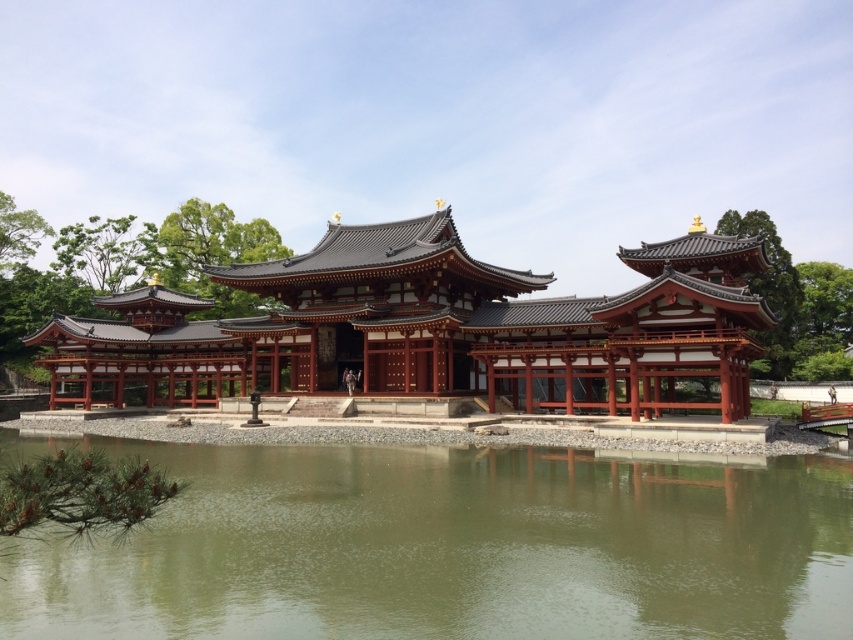
Question: Which point is closer to the camera?

Choices:
 (A) shiny lacquered wooden pagoda at center
 (B) green reflective water at center

Answer: (B)

Question: Can you confirm if green reflective water at center is positioned above shiny lacquered wooden pagoda at center?

Choices:
 (A) yes
 (B) no

Answer: (B)

Question: Can you confirm if green reflective water at center is bigger than shiny lacquered wooden pagoda at center?

Choices:
 (A) no
 (B) yes

Answer: (A)

Question: Does green reflective water at center appear on the left side of shiny lacquered wooden pagoda at center?

Choices:
 (A) no
 (B) yes

Answer: (A)